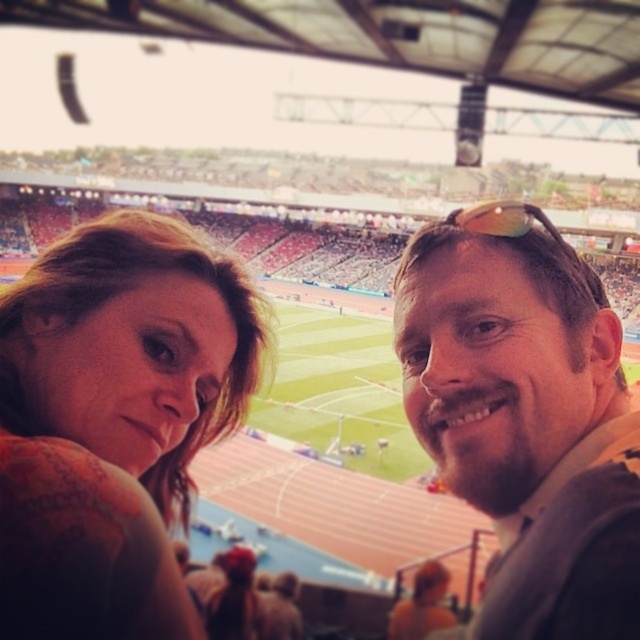
Question: Which object appears farthest from the camera in this image?

Choices:
 (A) matte orange shirt at left
 (B) brown hair at upper right
 (C) translucent yellow-green sunglasses at center

Answer: (C)

Question: Observing the image, what is the correct spatial positioning of matte orange shirt at left in reference to brown hair at upper right?

Choices:
 (A) left
 (B) right

Answer: (A)

Question: Does matte orange shirt at left appear over translucent yellow-green sunglasses at center?

Choices:
 (A) yes
 (B) no

Answer: (B)

Question: Estimate the real-world distances between objects in this image. Which object is closer to the brown hair at upper right?

Choices:
 (A) matte orange shirt at left
 (B) translucent yellow-green sunglasses at center

Answer: (B)

Question: From the image, what is the correct spatial relationship of brown hair at upper right in relation to translucent yellow-green sunglasses at center?

Choices:
 (A) right
 (B) left

Answer: (B)

Question: Considering the real-world distances, which object is closest to the translucent yellow-green sunglasses at center?

Choices:
 (A) brown hair at upper right
 (B) matte orange shirt at left

Answer: (A)